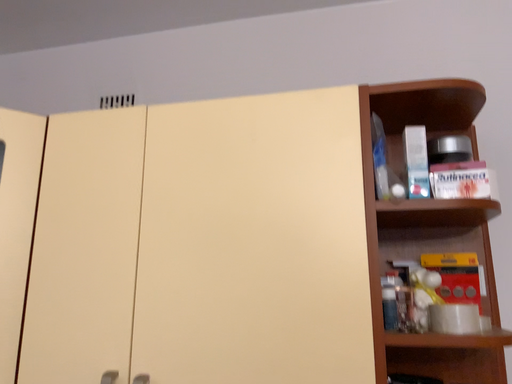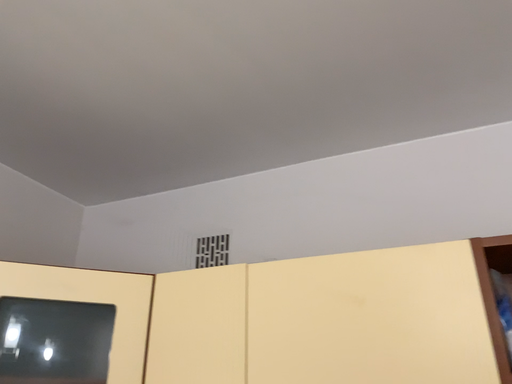
Question: Which way did the camera rotate in the video?

Choices:
 (A) rotated left
 (B) rotated right

Answer: (A)